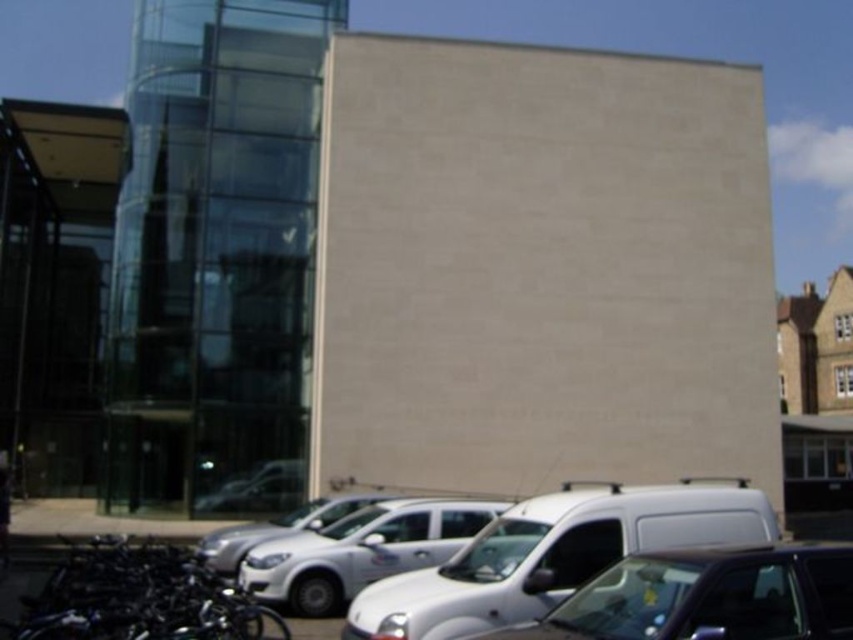
Looking at this image, you are a delivery person who needs to park your vehicle in a tight space between the white matte van at lower center and the silver metallic car at center. Based on their heights, which vehicle would require more vertical clearance to avoid scraping the roof?

The white matte van at lower center requires more vertical clearance because it is much taller than the silver metallic car at center.

You are a delivery driver who needs to park your vehicle in a tight space between the white matte van at lower center and the silver metallic car at center. Considering their sizes, which vehicle will require more space to maneuver around?

The white matte van at lower center is bigger than the silver metallic car at center, so it will require more space to maneuver around.

Based on the photo, you are standing in the middle of the street looking at the modern glass building on the left and the beige wall on the right. There is a white matte van parked at lower center. Can you tell me the location of the point with coordinates (555, 554)?

The point with coordinates (555, 554) is located on the white matte van at lower center.